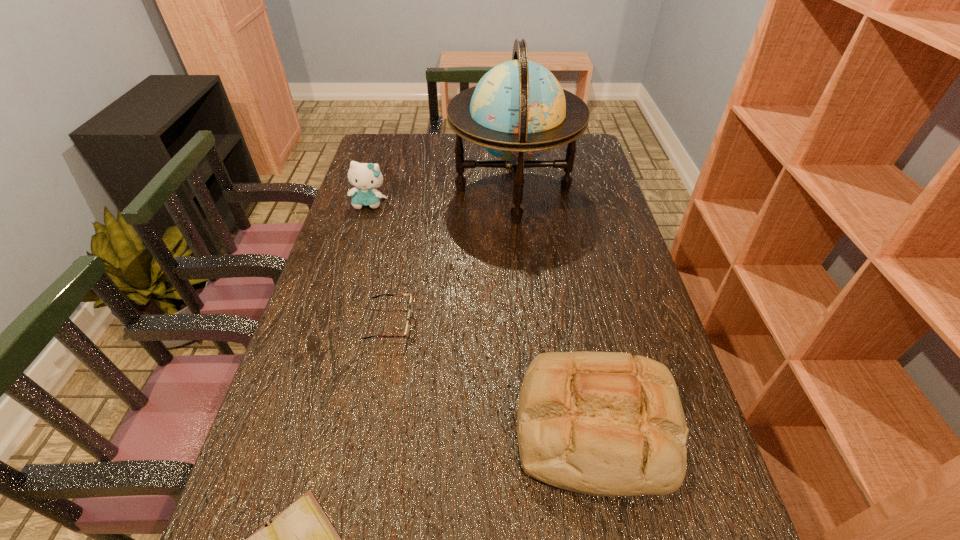
The height and width of the screenshot is (540, 960). What are the coordinates of `free spot located 0.090m on the frame of the fourth tallest object` in the screenshot? It's located at (x=449, y=324).

Locate an element on the screen. object located at the far edge is located at coordinates (518, 110).

Image resolution: width=960 pixels, height=540 pixels. I want to click on kitten that is at the left edge, so click(x=365, y=177).

Identify the location of spectacles located in the left edge section of the desktop. This screenshot has width=960, height=540. (408, 327).

Where is `globe positioned at the right edge`? This screenshot has width=960, height=540. globe positioned at the right edge is located at coordinates (518, 110).

Where is `bread at the right edge`? bread at the right edge is located at coordinates (599, 423).

The height and width of the screenshot is (540, 960). I want to click on object located in the far right corner section of the desktop, so click(518, 110).

You are a GUI agent. You are given a task and a screenshot of the screen. Output one action in this format:
    pyautogui.click(x=<x>, y=<y>)
    Task: Click on the vacant space at the far edge of the desktop
    
    Given the screenshot: What is the action you would take?
    pyautogui.click(x=418, y=158)

Identify the location of vacant space at the left edge of the desktop. (394, 173).

Where is `free region at the right edge`? The width and height of the screenshot is (960, 540). free region at the right edge is located at coordinates (651, 305).